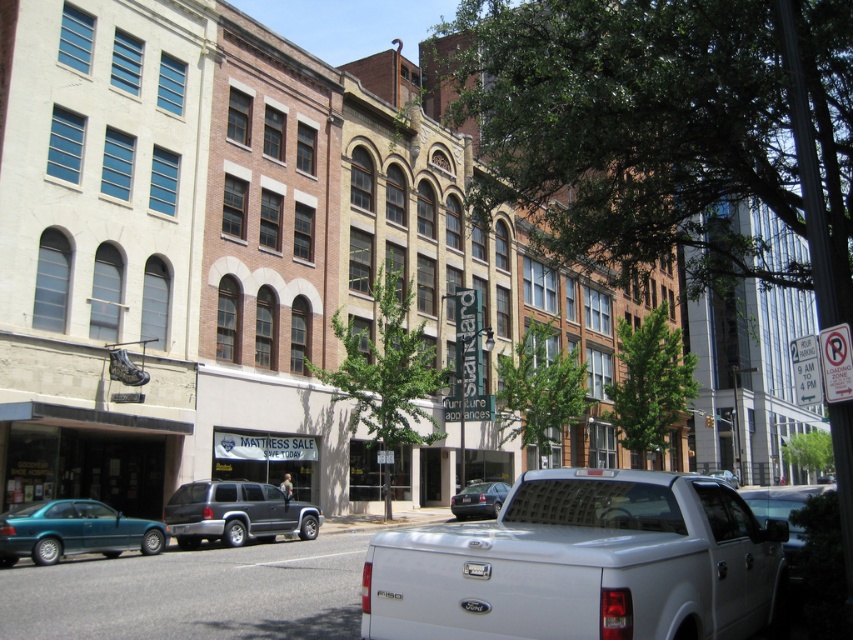
Question: Observing the image, what is the correct spatial positioning of teal glossy sedan at lower left in reference to matte gray suv at center?

Choices:
 (A) above
 (B) below

Answer: (A)

Question: Is teal glossy sedan at lower left positioned at the back of matte gray suv at center?

Choices:
 (A) yes
 (B) no

Answer: (B)

Question: Which point is farther to the camera?

Choices:
 (A) shiny black sedan at center
 (B) teal glossy sedan at lower left
 (C) metallic silver truck at right
 (D) white matte truck bed at center

Answer: (A)

Question: Considering the relative positions of teal glossy sedan at lower left and matte gray suv at center in the image provided, where is teal glossy sedan at lower left located with respect to matte gray suv at center?

Choices:
 (A) right
 (B) left

Answer: (B)

Question: Among these objects, which one is farthest from the camera?

Choices:
 (A) white matte truck bed at center
 (B) shiny black sedan at center

Answer: (B)

Question: Among these points, which one is farthest from the camera?

Choices:
 (A) (830, 490)
 (B) (503, 490)
 (C) (715, 627)
 (D) (228, 483)

Answer: (B)